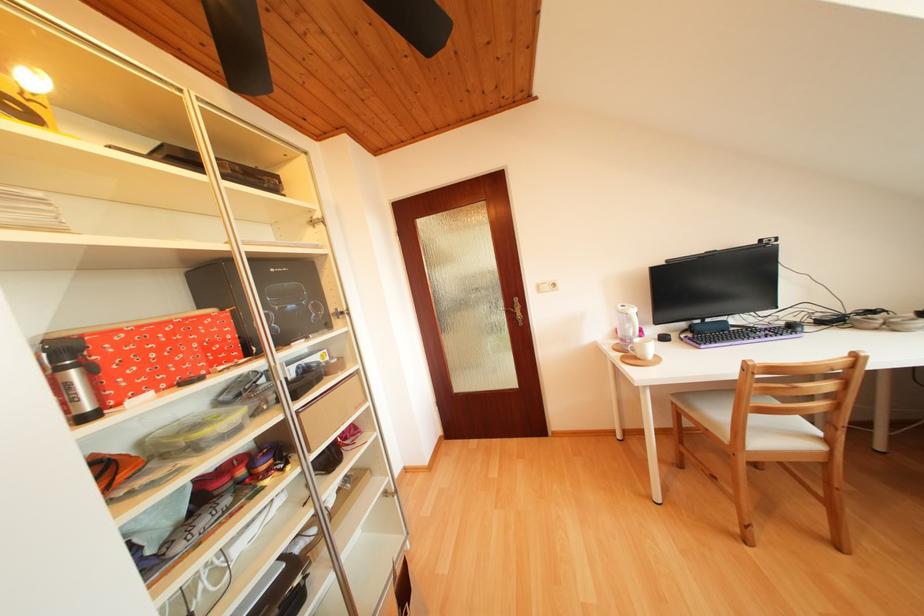
Find the location of a particular element. The width and height of the screenshot is (924, 616). chair sitting surface is located at coordinates [x=777, y=429].